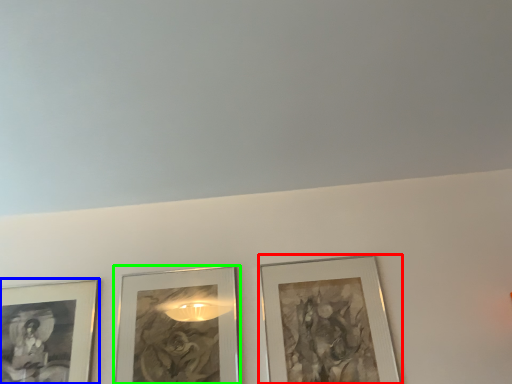
Question: Considering the real-world distances, which object is farthest from picture frame (highlighted by a red box)? picture frame (highlighted by a blue box) or picture frame (highlighted by a green box)?

Choices:
 (A) picture frame
 (B) picture frame

Answer: (A)